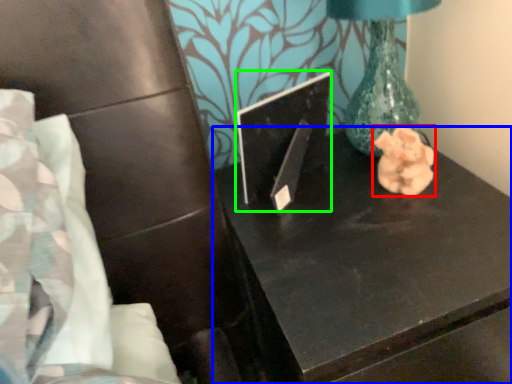
Question: Considering the real-world distances, which object is closest to animal (highlighted by a red box)? table (highlighted by a blue box) or laptop (highlighted by a green box).

Choices:
 (A) table
 (B) laptop

Answer: (A)